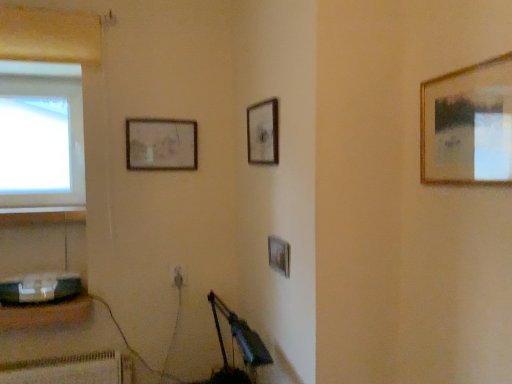
Question: From a real-world perspective, is gold metallic picture frame at upper right, which is the 1th picture frame from right to left, positioned above or below metallic gray speaker at lower left?

Choices:
 (A) above
 (B) below

Answer: (A)

Question: Is gold metallic picture frame at upper right, the 4th picture frame in the back-to-front sequence, situated inside metallic gray speaker at lower left or outside?

Choices:
 (A) inside
 (B) outside

Answer: (B)

Question: Which of these objects is positioned closest to the white plastic electric outlet at lower center?

Choices:
 (A) matte wooden picture frame at upper center, marked as the first picture frame in a left-to-right arrangement
 (B) wooden picture frame at center, arranged as the 3th picture frame when viewed from the back
 (C) wooden picture frame at upper center, positioned as the third picture frame in front-to-back order
 (D) metallic gray speaker at lower left
 (E) gold metallic picture frame at upper right, which appears as the 4th picture frame when viewed from the left

Answer: (D)

Question: Estimate the real-world distances between objects in this image. Which object is farther from the matte wooden picture frame at upper center, placed as the fourth picture frame when sorted from front to back?

Choices:
 (A) wooden picture frame at upper center, positioned as the third picture frame in front-to-back order
 (B) gold metallic picture frame at upper right, which is the 1th picture frame from right to left
 (C) metallic gray speaker at lower left
 (D) wooden picture frame at center, the 2th picture frame viewed from the right
 (E) transparent glass window at upper left

Answer: (B)